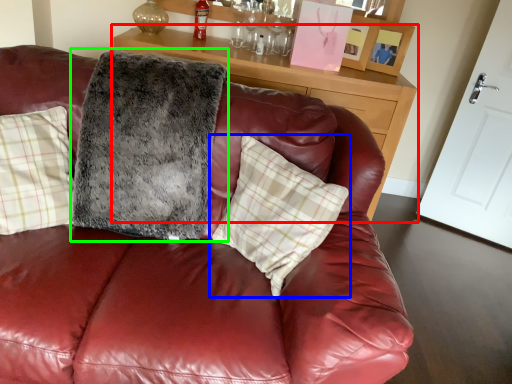
Question: Which object is the closest to the table (highlighted by a red box)? Choose among these: pillow (highlighted by a blue box) or blanket (highlighted by a green box).

Choices:
 (A) pillow
 (B) blanket

Answer: (B)